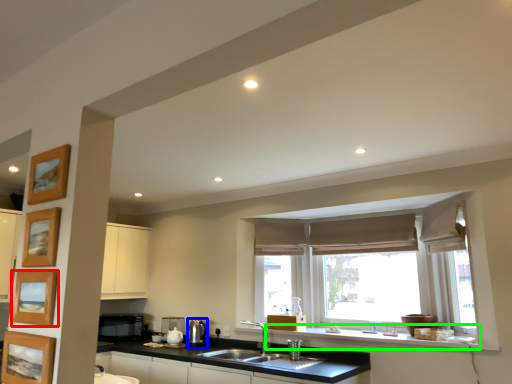
Question: Estimate the real-world distances between objects in this image. Which object is closer to picture frame (highlighted by a red box), appliance (highlighted by a blue box) or window sill (highlighted by a green box)?

Choices:
 (A) appliance
 (B) window sill

Answer: (B)